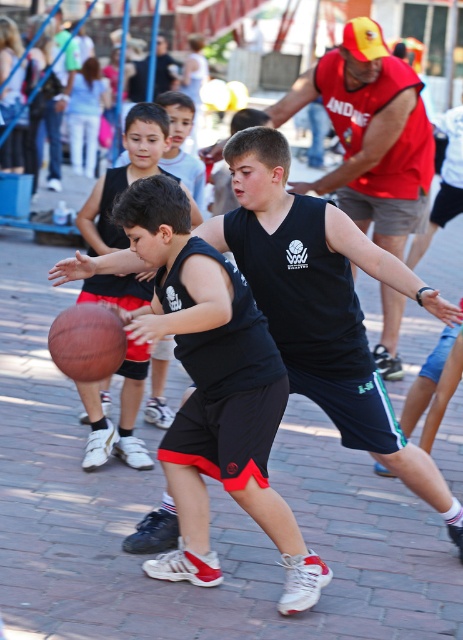
Does black matte shorts at center appear under brown leather basketball at center?

Yes.

Does black matte shorts at center appear over brown leather basketball at center?

No, black matte shorts at center is not above brown leather basketball at center.

This screenshot has width=463, height=640. What do you see at coordinates (216, 396) in the screenshot?
I see `black matte shorts at center` at bounding box center [216, 396].

The height and width of the screenshot is (640, 463). I want to click on black matte shorts at center, so click(x=216, y=396).

Looking at this image, does matte black basketball at left appear on the left side of brown leather basketball at center?

In fact, matte black basketball at left is to the right of brown leather basketball at center.

Which of these two, matte black basketball at left or brown leather basketball at center, stands shorter?

With less height is brown leather basketball at center.

What do you see at coordinates (125, 177) in the screenshot? I see `matte black basketball at left` at bounding box center [125, 177].

In order to click on matte black basketball at left in this screenshot , I will do (125, 177).

Is black matte shorts at center thinner than matte black basketball at left?

Incorrect, black matte shorts at center's width is not less than matte black basketball at left's.

Between point (230, 477) and point (130, 353), which one is positioned behind?

The point (130, 353) is behind.

Between point (296, 586) and point (142, 358), which one is positioned in front?

Positioned in front is point (296, 586).

The height and width of the screenshot is (640, 463). I want to click on black matte shorts at center, so click(216, 396).